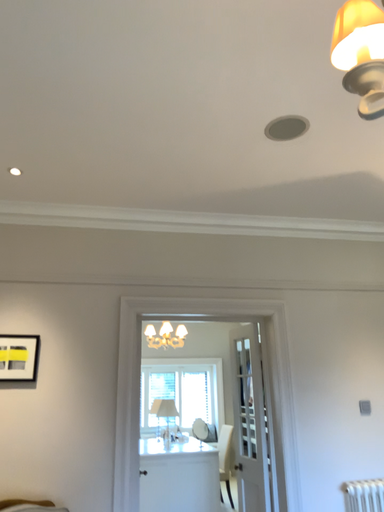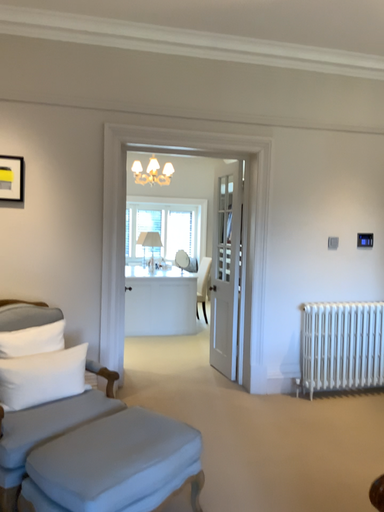
Question: How did the camera likely rotate when shooting the video?

Choices:
 (A) rotated downward
 (B) rotated upward

Answer: (A)